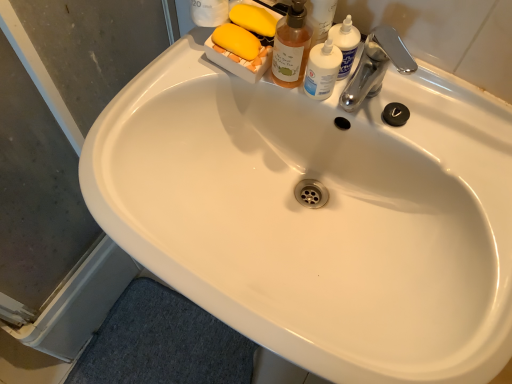
Where is `free spot to the right of translucent amber bottle at upper right`? free spot to the right of translucent amber bottle at upper right is located at coordinates (421, 113).